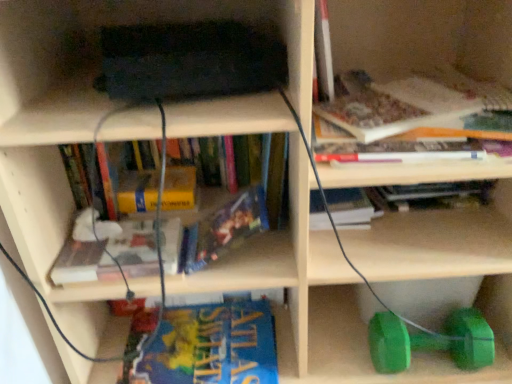
Question: Considering the relative sizes of hardcover book at upper right, the 2th book when ordered from top to bottom, and green rubber dumbbell at lower right in the image provided, is hardcover book at upper right, the 2th book when ordered from top to bottom, smaller than green rubber dumbbell at lower right?

Choices:
 (A) yes
 (B) no

Answer: (B)

Question: Does hardcover book at upper right, the 2th book when ordered from top to bottom, appear on the left side of green rubber dumbbell at lower right?

Choices:
 (A) no
 (B) yes

Answer: (B)

Question: From the image's perspective, is hardcover book at upper right, which is the seventh book in bottom-to-top order, on green rubber dumbbell at lower right?

Choices:
 (A) no
 (B) yes

Answer: (B)

Question: Is hardcover book at upper right, the 2th book when ordered from top to bottom, not inside green rubber dumbbell at lower right?

Choices:
 (A) no
 (B) yes

Answer: (B)

Question: From a real-world perspective, does hardcover book at upper right, which is the seventh book in bottom-to-top order, stand above green rubber dumbbell at lower right?

Choices:
 (A) yes
 (B) no

Answer: (A)

Question: Visually, is blue glossy book at lower center, positioned as the 1th book in bottom-to-top order, positioned to the left or to the right of hardcover book at upper right, the 2th book when ordered from top to bottom?

Choices:
 (A) right
 (B) left

Answer: (B)

Question: From a real-world perspective, is blue glossy book at lower center, positioned as the 1th book in bottom-to-top order, above or below hardcover book at upper right, which is the seventh book in bottom-to-top order?

Choices:
 (A) below
 (B) above

Answer: (A)

Question: Considering the positions of blue glossy book at lower center, positioned as the 1th book in bottom-to-top order, and hardcover book at upper right, which is the seventh book in bottom-to-top order, in the image, is blue glossy book at lower center, positioned as the 1th book in bottom-to-top order, wider or thinner than hardcover book at upper right, which is the seventh book in bottom-to-top order,?

Choices:
 (A) wide
 (B) thin

Answer: (B)

Question: Considering the positions of blue glossy book at lower center, the 8th book in the top-to-bottom sequence, and hardcover book at upper right, which is the seventh book in bottom-to-top order, in the image, is blue glossy book at lower center, the 8th book in the top-to-bottom sequence, bigger or smaller than hardcover book at upper right, which is the seventh book in bottom-to-top order,?

Choices:
 (A) big
 (B) small

Answer: (B)

Question: In the image, is hardcover book at upper right, acting as the first book starting from the top, on the left side or the right side of green rubber dumbbell at lower right?

Choices:
 (A) right
 (B) left

Answer: (B)

Question: From a real-world perspective, is hardcover book at upper right, acting as the first book starting from the top, above or below green rubber dumbbell at lower right?

Choices:
 (A) below
 (B) above

Answer: (B)

Question: Is point (317, 21) positioned closer to the camera than point (485, 324)?

Choices:
 (A) closer
 (B) farther

Answer: (A)

Question: Looking at the image, does hardcover book at upper right, which is the eighth book from bottom to top, seem bigger or smaller compared to green rubber dumbbell at lower right?

Choices:
 (A) small
 (B) big

Answer: (A)

Question: Considering the positions of point (223, 360) and point (263, 211), is point (223, 360) closer or farther from the camera than point (263, 211)?

Choices:
 (A) farther
 (B) closer

Answer: (A)

Question: Is blue glossy book at lower center, the 8th book in the top-to-bottom sequence, inside or outside of hardcover book at center, the fifth book from the top?

Choices:
 (A) outside
 (B) inside

Answer: (A)